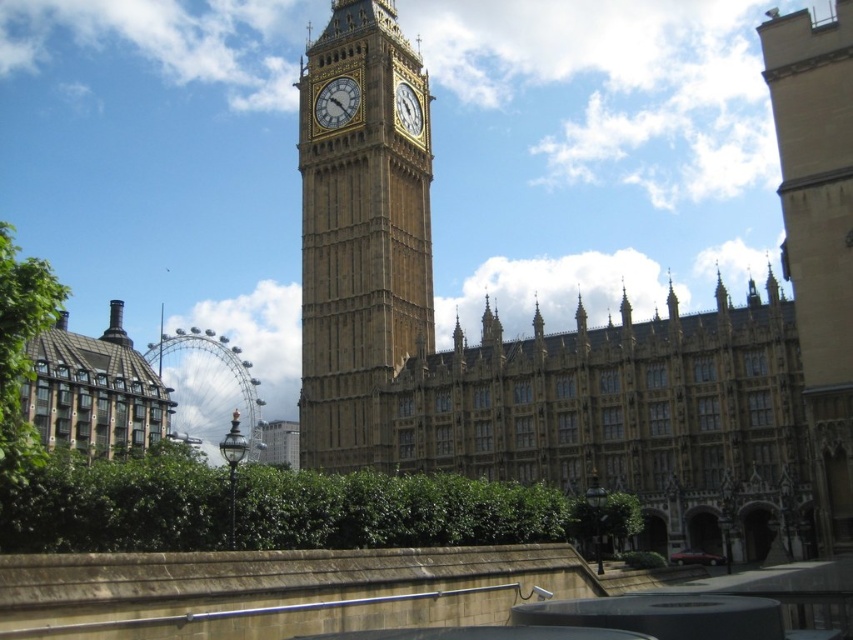
What are the coordinates of `golden stone clock tower at center` in the screenshot? It's located at (360, 240).

Is point (360, 115) closer to viewer compared to point (328, 81)?

Yes.

You are a GUI agent. You are given a task and a screenshot of the screen. Output one action in this format:
    pyautogui.click(x=<x>, y=<y>)
    Task: Click on the golden stone clock tower at center
    
    Given the screenshot: What is the action you would take?
    pyautogui.click(x=360, y=240)

Is gold textured clock at center further to the viewer compared to gold stone clock at center?

Yes, gold textured clock at center is behind gold stone clock at center.

Does gold textured clock at center appear on the left side of gold stone clock at center?

Correct, you'll find gold textured clock at center to the left of gold stone clock at center.

Who is more forward, [334,93] or [402,125]?

Positioned in front is point [402,125].

Locate an element on the screen. The width and height of the screenshot is (853, 640). gold textured clock at center is located at coordinates (337, 102).

Measure the distance between point (90, 392) and camera.

Point (90, 392) and camera are 361.93 feet apart.

Is green textured building at lower left taller than gold stone clock at center?

Correct, green textured building at lower left is much taller as gold stone clock at center.

Does point (131, 413) lie behind point (421, 116)?

Yes, it is.

Where is `green textured building at lower left`? green textured building at lower left is located at coordinates (93, 390).